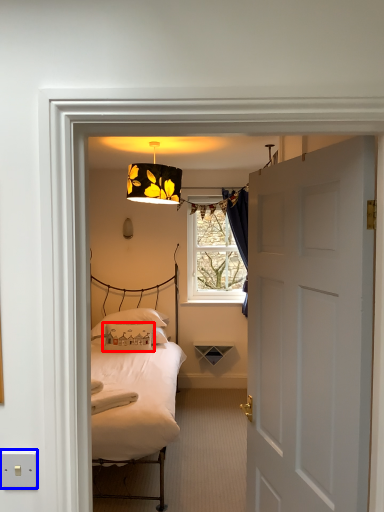
Question: Which object appears closest to the camera in this image, pillow (highlighted by a red box) or electric outlet (highlighted by a blue box)?

Choices:
 (A) pillow
 (B) electric outlet

Answer: (B)